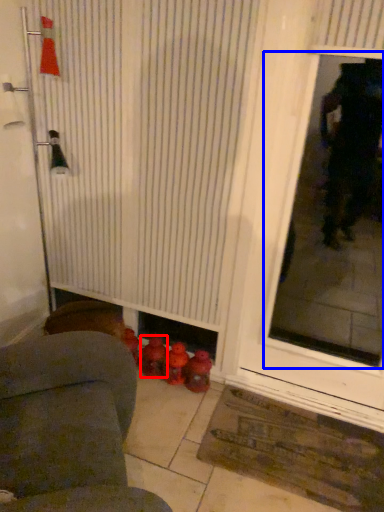
Question: Which of the following is the closest to the observer, toy (highlighted by a red box) or window screen (highlighted by a blue box)?

Choices:
 (A) toy
 (B) window screen

Answer: (B)